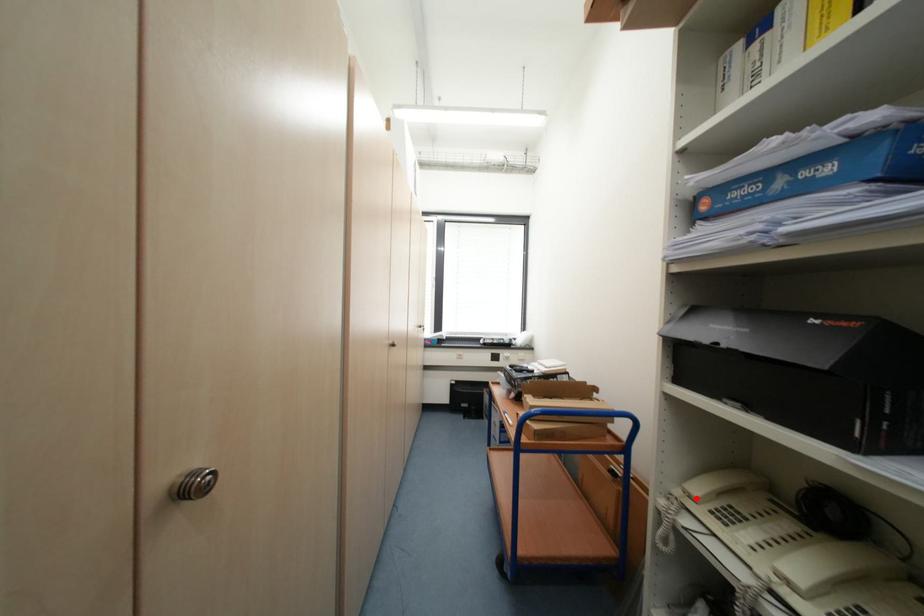
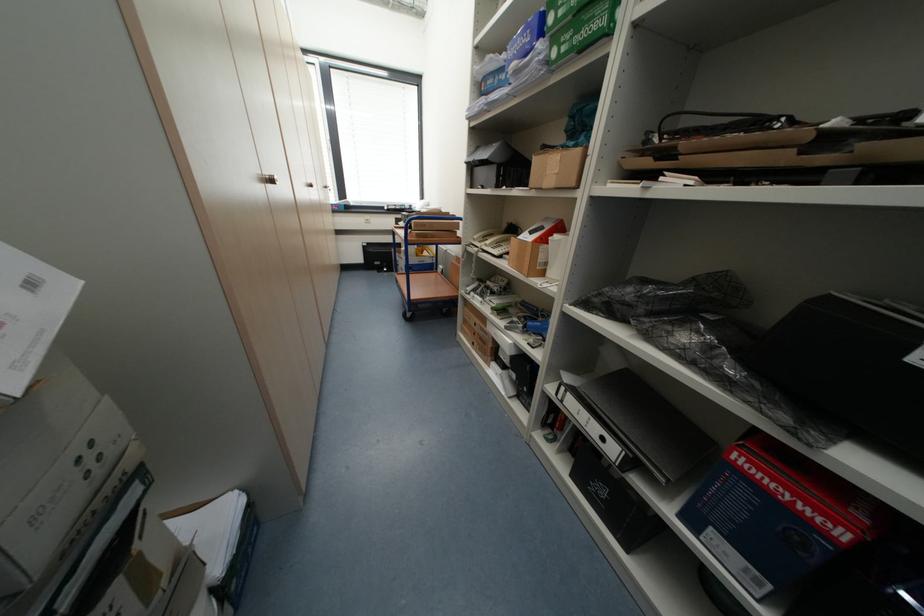
The point at the highlighted location is marked in the first image. Where is the corresponding point in the second image?

(480, 240)